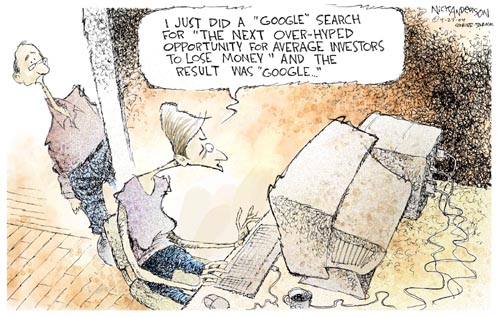
The width and height of the screenshot is (500, 317). I want to click on keyboard, so click(252, 263).